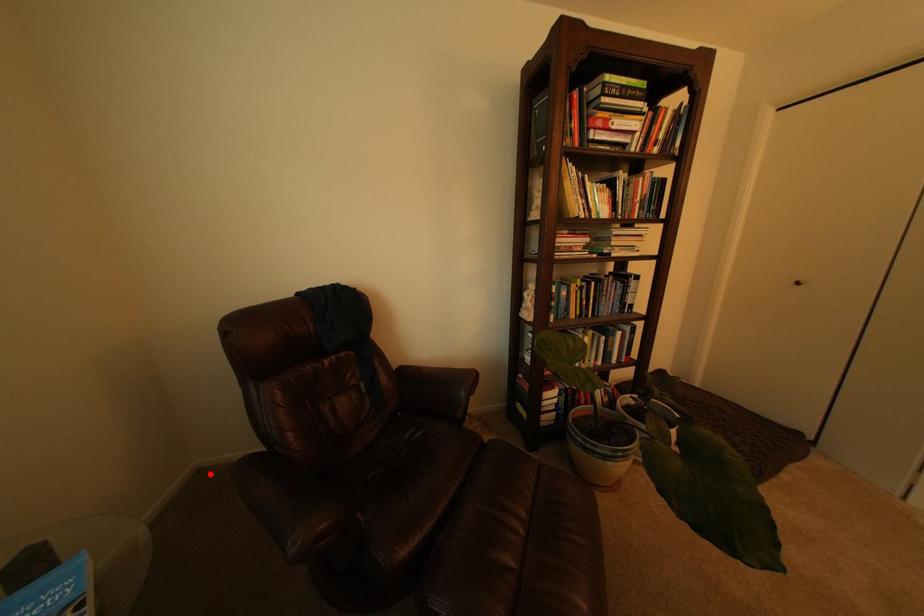
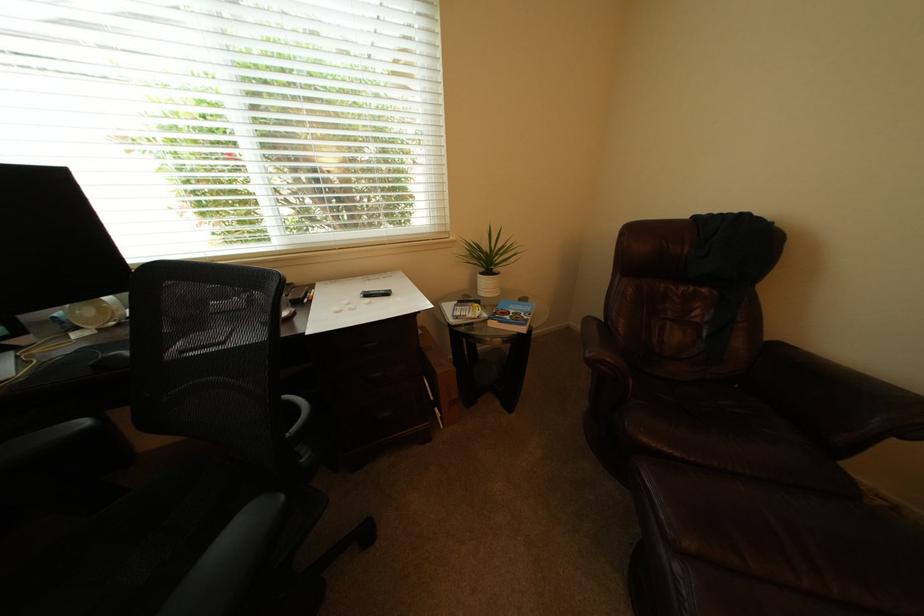
Question: I am providing you with two images of the same scene from different viewpoints. A red point is marked on the first image. Can you still see the location of the red point in image 2?

Choices:
 (A) Yes
 (B) No

Answer: (A)